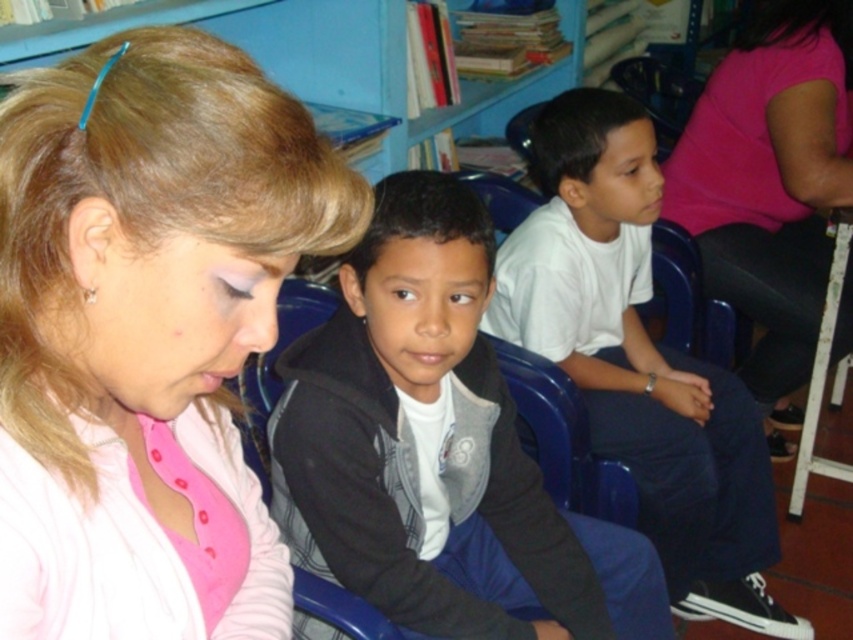
Is the position of pink fabric at center more distant than that of white matte shirt at center?

No.

Can you confirm if pink fabric at center is taller than white matte shirt at center?

Incorrect, pink fabric at center's height is not larger of white matte shirt at center's.

Does point (161, 282) come farther from viewer compared to point (612, 248)?

That is False.

At what (x,y) coordinates should I click in order to perform the action: click on pink fabric at center. Please return your answer as a coordinate pair (x, y). The image size is (853, 640). Looking at the image, I should click on (143, 308).

From the picture: Can you confirm if matte black hoodie at center is wider than pink fabric shirt at upper right?

Yes, matte black hoodie at center is wider than pink fabric shirt at upper right.

Is point (466, 556) in front of point (779, 60)?

Yes, it is in front of point (779, 60).

Is point (335, 330) positioned behind point (732, 166)?

No, (335, 330) is closer to viewer.

I want to click on matte black hoodie at center, so click(436, 449).

Is pink fabric at center shorter than pink fabric shirt at upper right?

Indeed, pink fabric at center has a lesser height compared to pink fabric shirt at upper right.

Is pink fabric at center smaller than pink fabric shirt at upper right?

Yes, pink fabric at center is smaller than pink fabric shirt at upper right.

You are a GUI agent. You are given a task and a screenshot of the screen. Output one action in this format:
    pyautogui.click(x=<x>, y=<y>)
    Task: Click on the pink fabric at center
    
    Given the screenshot: What is the action you would take?
    pyautogui.click(x=143, y=308)